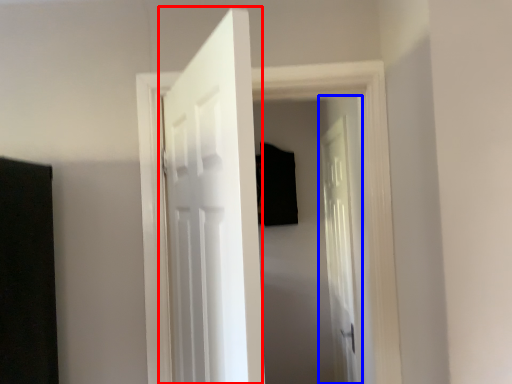
Question: Which object appears closest to the camera in this image, door (highlighted by a red box) or door (highlighted by a blue box)?

Choices:
 (A) door
 (B) door

Answer: (A)